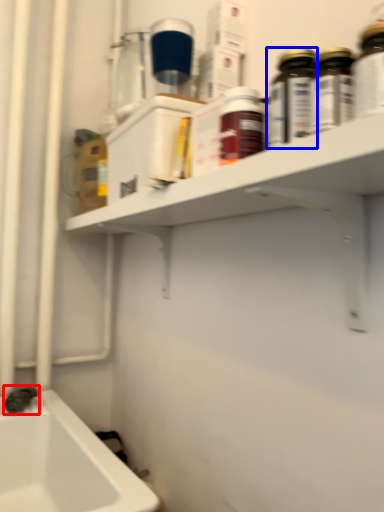
Question: Which object is further to the camera taking this photo, plumbing fixture (highlighted by a red box) or bottle (highlighted by a blue box)?

Choices:
 (A) plumbing fixture
 (B) bottle

Answer: (A)